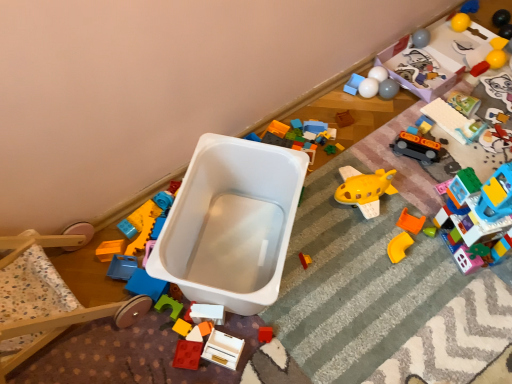
The image size is (512, 384). I want to click on vacant region to the right of orange plastic train at center, which ranks as the sixth toy in right-to-left order, so click(x=456, y=150).